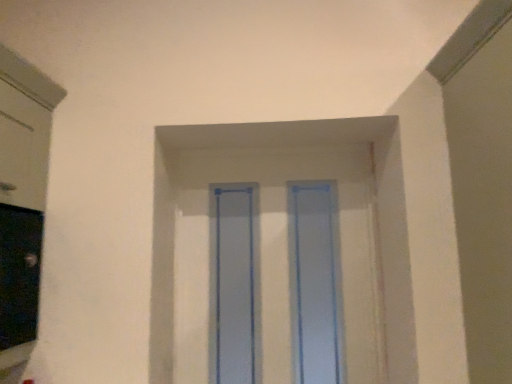
Question: Does transparent plastic window frame at center come in front of transparent plastic glass door at center?

Choices:
 (A) no
 (B) yes

Answer: (A)

Question: Is transparent plastic window frame at center beside transparent plastic glass door at center?

Choices:
 (A) yes
 (B) no

Answer: (A)

Question: From the image's perspective, is transparent plastic window frame at center beneath transparent plastic glass door at center?

Choices:
 (A) yes
 (B) no

Answer: (A)

Question: Is transparent plastic window frame at center at the left side of transparent plastic glass door at center?

Choices:
 (A) yes
 (B) no

Answer: (B)

Question: Considering the relative sizes of transparent plastic window frame at center and transparent plastic glass door at center in the image provided, is transparent plastic window frame at center smaller than transparent plastic glass door at center?

Choices:
 (A) no
 (B) yes

Answer: (B)

Question: Is transparent plastic window frame at center looking in the opposite direction of transparent plastic glass door at center?

Choices:
 (A) no
 (B) yes

Answer: (B)

Question: Is transparent plastic glass door at center far from transparent plastic window frame at center?

Choices:
 (A) yes
 (B) no

Answer: (B)

Question: Does transparent plastic glass door at center appear on the right side of transparent plastic window frame at center?

Choices:
 (A) no
 (B) yes

Answer: (A)

Question: From the image's perspective, is transparent plastic glass door at center on top of transparent plastic window frame at center?

Choices:
 (A) yes
 (B) no

Answer: (A)

Question: Can transparent plastic window frame at center be found inside transparent plastic glass door at center?

Choices:
 (A) yes
 (B) no

Answer: (A)

Question: From a real-world perspective, does transparent plastic glass door at center sit lower than transparent plastic window frame at center?

Choices:
 (A) yes
 (B) no

Answer: (B)

Question: From the image's perspective, is transparent plastic glass door at center located beneath transparent plastic window frame at center?

Choices:
 (A) no
 (B) yes

Answer: (A)

Question: From the image's perspective, is transparent plastic glass door at center above or below transparent plastic window frame at center?

Choices:
 (A) below
 (B) above

Answer: (B)